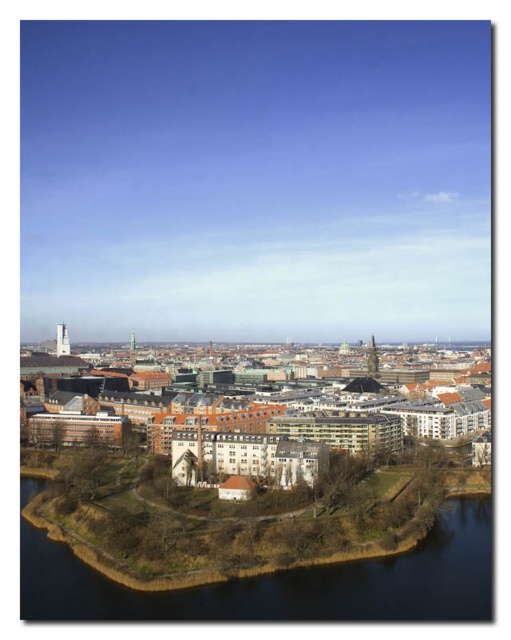
You are standing on the grassy island and want to take a photo of the dark blue water at lower left and brown brick buildings at center. Which object should you position closer to the front of your photo?

You should position the brown brick buildings at center closer to the front of your photo because the dark blue water at lower left is behind them.

You are a city planner reviewing this area and want to know if the brown brick buildings at center can be expanded horizontally without encroaching on the dark blue water at lower left. Based on the current layout, is there enough space for expansion?

The brown brick buildings at center might be wider than dark blue water at lower left, so there may not be sufficient space for horizontal expansion without affecting the water area.

You are standing at the camera position looking at the cityscape. There is a point marked at coordinates point (157,376). Can you estimate how far this point is from your current position?

The point (157,376) is 393.89 meters away from the camera position.